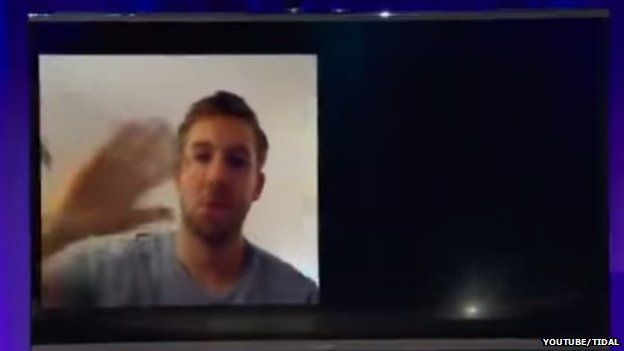
You are a GUI agent. You are given a task and a screenshot of the screen. Output one action in this format:
    pyautogui.click(x=<x>, y=<y>)
    Task: Click on the computer screen
    The width and height of the screenshot is (624, 351).
    Given the screenshot: What is the action you would take?
    pyautogui.click(x=339, y=17)